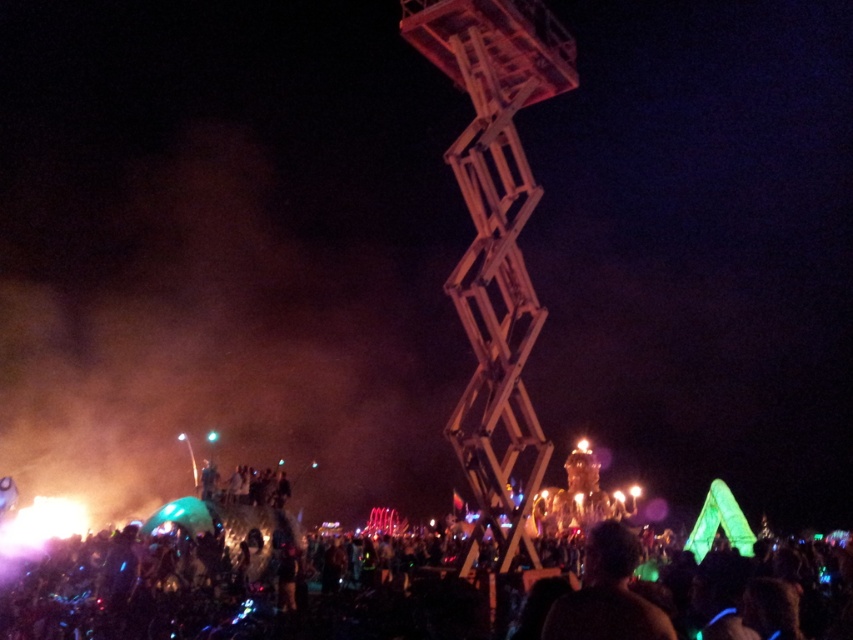
Is wooden at center wider than black matte person at lower center?

Incorrect, wooden at center's width does not surpass black matte person at lower center's.

Is point (463, 68) farther from camera compared to point (656, 637)?

Yes, it is.

Between point (479, 285) and point (605, 595), which one is positioned behind?

The point (479, 285) is more distant.

The image size is (853, 640). I want to click on wooden at center, so click(491, 307).

Is point (506, 566) positioned behind point (276, 476)?

No, it is in front of (276, 476).

Identify the location of wooden at center. (491, 307).

Can you confirm if black matte crowd at lower center is positioned to the right of black matte person at lower center?

No, black matte crowd at lower center is not to the right of black matte person at lower center.

Is point (798, 627) more distant than point (584, 632)?

That is True.

Is point (341, 604) closer to camera compared to point (599, 536)?

No, it is not.

Where is `black matte crowd at lower center`? black matte crowd at lower center is located at coordinates (254, 600).